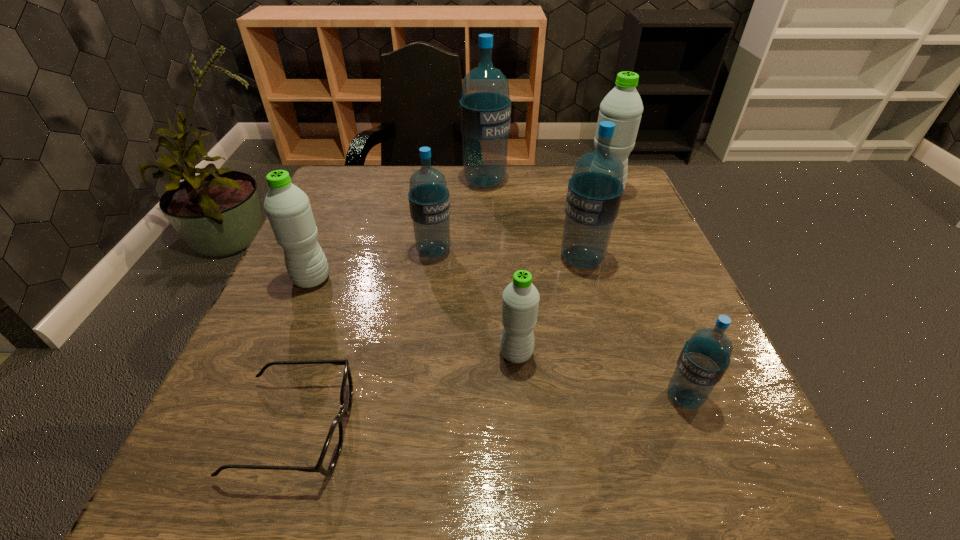
Where is `the nearest water bottle`? This screenshot has width=960, height=540. the nearest water bottle is located at coordinates (705, 357).

This screenshot has width=960, height=540. What are the coordinates of `the nearest blue water bottle` in the screenshot? It's located at (705, 357).

Where is `the smallest green water bottle`? The image size is (960, 540). the smallest green water bottle is located at coordinates (520, 300).

Locate an element on the screen. the second nearest water bottle is located at coordinates (520, 300).

Where is `spectacles`? spectacles is located at coordinates (332, 447).

Locate an element on the screen. The width and height of the screenshot is (960, 540). vacant area located on the left of the tallest water bottle is located at coordinates (410, 182).

Find the location of `free point located 0.250m on the front of the farthest green water bottle`. free point located 0.250m on the front of the farthest green water bottle is located at coordinates (633, 270).

Locate an element on the screen. The height and width of the screenshot is (540, 960). free location located 0.400m on the front of the third object from right to left is located at coordinates [x=636, y=466].

The image size is (960, 540). Find the location of `vacant space located on the front of the second farthest green water bottle`. vacant space located on the front of the second farthest green water bottle is located at coordinates (287, 339).

The height and width of the screenshot is (540, 960). Identify the location of vacant space located 0.190m on the left of the sixth object from right to left. (328, 251).